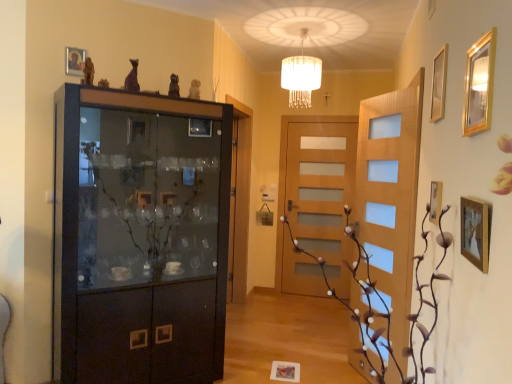
The height and width of the screenshot is (384, 512). What do you see at coordinates (75, 61) in the screenshot?
I see `wooden picture frame at upper left, which appears as the fifth picture frame when viewed from the right` at bounding box center [75, 61].

How much space does wooden picture frame at upper left, arranged as the 5th picture frame when ordered from the bottom, occupy horizontally?

The width of wooden picture frame at upper left, arranged as the 5th picture frame when ordered from the bottom, is 0.90 inches.

In order to face gold-framed mirror at upper right, which ranks as the 3th picture frame in bottom-to-top order, should I rotate leftwards or rightwards?

To align with it, rotate right about 27.551°.

Where is `gold metallic picture frame at upper right, the third picture frame from the front`? The width and height of the screenshot is (512, 384). gold metallic picture frame at upper right, the third picture frame from the front is located at coordinates (439, 84).

What is the approximate height of brown textured plant at center?

It is 1.06 meters.

The height and width of the screenshot is (384, 512). In order to click on wooden picture frame at upper left, arranged as the 5th picture frame when ordered from the bottom in this screenshot , I will do `click(75, 61)`.

Is wooden picture frame at upper left, which appears as the fifth picture frame when viewed from the right, looking in the opposite direction of white fabric lampshade at upper center?

No, white fabric lampshade at upper center is not at the back of wooden picture frame at upper left, which appears as the fifth picture frame when viewed from the right.

Are wooden picture frame at upper left, which is counted as the 4th picture frame, starting from the front, and white fabric lampshade at upper center located far from each other?

That's right, there is a large distance between wooden picture frame at upper left, which is counted as the 4th picture frame, starting from the front, and white fabric lampshade at upper center.

Does wooden picture frame at upper left, which appears as the fifth picture frame when viewed from the right, have a lesser width compared to white fabric lampshade at upper center?

Yes.

Can white fabric lampshade at upper center be found inside wooden picture frame at upper left, acting as the first picture frame starting from the left?

No, white fabric lampshade at upper center is not inside wooden picture frame at upper left, acting as the first picture frame starting from the left.

Which point is more forward, (213, 134) or (67, 64)?

Positioned in front is point (67, 64).

Considering the sizes of objects matte black cabinet at left and wooden picture frame at upper left, which is counted as the 4th picture frame, starting from the front, in the image provided, who is taller, matte black cabinet at left or wooden picture frame at upper left, which is counted as the 4th picture frame, starting from the front,?

With more height is matte black cabinet at left.

Find the location of a particular element. The height and width of the screenshot is (384, 512). cupboard on the right of wooden picture frame at upper left, arranged as the 5th picture frame when ordered from the bottom is located at coordinates (140, 237).

Is wooden picture frame at upper left, which appears as the fifth picture frame when viewed from the right, bigger or smaller than gold-framed mirror at upper right, which appears as the third picture frame when viewed from the top?

wooden picture frame at upper left, which appears as the fifth picture frame when viewed from the right, is smaller than gold-framed mirror at upper right, which appears as the third picture frame when viewed from the top.

Is there a large distance between wooden picture frame at upper left, which appears as the fifth picture frame when viewed from the right, and gold-framed mirror at upper right, positioned as the 2th picture frame in right-to-left order?

wooden picture frame at upper left, which appears as the fifth picture frame when viewed from the right, is positioned a significant distance from gold-framed mirror at upper right, positioned as the 2th picture frame in right-to-left order.

How much distance is there between wooden picture frame at upper left, positioned as the second picture frame in back-to-front order, and gold-framed mirror at upper right, which ranks as the 3th picture frame in bottom-to-top order?

wooden picture frame at upper left, positioned as the second picture frame in back-to-front order, is 7.08 feet from gold-framed mirror at upper right, which ranks as the 3th picture frame in bottom-to-top order.

From the image's perspective, is wooden picture frame at upper left, which is counted as the 4th picture frame, starting from the front, located above or below gold-framed mirror at upper right, which appears as the third picture frame when viewed from the top?

wooden picture frame at upper left, which is counted as the 4th picture frame, starting from the front, is above gold-framed mirror at upper right, which appears as the third picture frame when viewed from the top.

Locate an element on the screen. The height and width of the screenshot is (384, 512). the 2nd picture frame in front of the wooden picture frame at lower center, the second picture frame when ordered from left to right is located at coordinates (439, 84).

Consider the image. Between gold metallic picture frame at upper right, positioned as the 2th picture frame in top-to-bottom order, and wooden picture frame at lower center, acting as the fourth picture frame starting from the right, which one has smaller size?

wooden picture frame at lower center, acting as the fourth picture frame starting from the right, is smaller.

Which is in front, point (434, 67) or point (298, 382)?

The point (434, 67) is more forward.

Is gold-framed mirror at upper right, which appears as the fourth picture frame when viewed from the back, smaller than wooden picture frame at upper left, which appears as the fifth picture frame when viewed from the right?

Actually, gold-framed mirror at upper right, which appears as the fourth picture frame when viewed from the back, might be larger than wooden picture frame at upper left, which appears as the fifth picture frame when viewed from the right.

Is gold-framed mirror at upper right, which ranks as the 3th picture frame in bottom-to-top order, inside or outside of wooden picture frame at upper left, which appears as the fifth picture frame when viewed from the right?

gold-framed mirror at upper right, which ranks as the 3th picture frame in bottom-to-top order, is not enclosed by wooden picture frame at upper left, which appears as the fifth picture frame when viewed from the right.

Considering the points (475, 62) and (78, 56), which point is in front, point (475, 62) or point (78, 56)?

The point (475, 62) is closer.

Identify the location of the 3rd picture frame counting from the left of the gold-framed mirror at upper right, which appears as the fourth picture frame when viewed from the back. Image resolution: width=512 pixels, height=384 pixels. (75, 61).

In the image, is white fabric lampshade at upper center on the left side or the right side of matte purple statue at upper center, the 2th art from the right?

From the image, it's evident that white fabric lampshade at upper center is to the right of matte purple statue at upper center, the 2th art from the right.

Considering the sizes of white fabric lampshade at upper center and matte purple statue at upper center, placed as the 1th art when sorted from left to right, in the image, is white fabric lampshade at upper center taller or shorter than matte purple statue at upper center, placed as the 1th art when sorted from left to right,?

white fabric lampshade at upper center is taller than matte purple statue at upper center, placed as the 1th art when sorted from left to right.

Which point is more distant from viewer, (306,86) or (127,75)?

The point (306,86) is behind.

Which object is thinner, wooden picture frame at lower center, marked as the 5th picture frame in a front-to-back arrangement, or wooden picture frame at right, the 1th picture frame when ordered from front to back?

With smaller width is wooden picture frame at right, the 1th picture frame when ordered from front to back.

Can wooden picture frame at right, which is counted as the 3th picture frame, starting from the left, be found inside wooden picture frame at lower center, marked as the 5th picture frame in a front-to-back arrangement?

No, wooden picture frame at right, which is counted as the 3th picture frame, starting from the left, is not surrounded by wooden picture frame at lower center, marked as the 5th picture frame in a front-to-back arrangement.

Who is taller, wooden picture frame at lower center, the second picture frame when ordered from left to right, or wooden picture frame at right, the 4th picture frame from the top?

wooden picture frame at right, the 4th picture frame from the top, is taller.

Is wooden picture frame at lower center, acting as the fourth picture frame starting from the right, positioned in front of wooden picture frame at right, arranged as the second picture frame when ordered from the bottom?

No, it is not.

The width and height of the screenshot is (512, 384). Identify the location of the 1st picture frame below the white fabric lampshade at upper center (from the image's perspective). (75, 61).

There is a matte black cabinet at left. At what (x,y) coordinates should I click in order to perform the action: click on the 4th picture frame above it (from the image's perspective). Please return your answer as a coordinate pair (x, y). This screenshot has height=384, width=512. Looking at the image, I should click on (75, 61).

Looking at the image, which one is located further to gold-framed mirror at upper right, the 2th picture frame positioned from the front, matte black cabinet at left or wooden picture frame at upper left, which is counted as the 4th picture frame, starting from the front?

wooden picture frame at upper left, which is counted as the 4th picture frame, starting from the front, is positioned further to the anchor gold-framed mirror at upper right, the 2th picture frame positioned from the front.

Considering their positions, is satin gold statue at upper center, which is the 2th art in left-to-right order, positioned closer to brown textured plant at center than matte black cabinet at left?

matte black cabinet at left lies closer to brown textured plant at center than the other object.

Looking at the image, which one is located closer to wooden picture frame at upper left, placed as the first picture frame when sorted from top to bottom, matte purple statue at upper center, the first art positioned from the front, or gold-framed mirror at upper right, which appears as the fourth picture frame when viewed from the back?

matte purple statue at upper center, the first art positioned from the front, is closer to wooden picture frame at upper left, placed as the first picture frame when sorted from top to bottom.

From the picture: Based on their spatial positions, is matte black cabinet at left or wooden picture frame at right, positioned as the third picture frame in right-to-left order, further from satin gold statue at upper center, which is the 1th art in right-to-left order?

Based on the image, wooden picture frame at right, positioned as the third picture frame in right-to-left order, appears to be further to satin gold statue at upper center, which is the 1th art in right-to-left order.

Looking at the image, which one is located closer to wooden picture frame at right, positioned as the third picture frame in right-to-left order, satin gold statue at upper center, which is the 2th art in left-to-right order, or gold metallic picture frame at upper right, marked as the first picture frame in a right-to-left arrangement?

Among the two, gold metallic picture frame at upper right, marked as the first picture frame in a right-to-left arrangement, is located nearer to wooden picture frame at right, positioned as the third picture frame in right-to-left order.

Estimate the real-world distances between objects in this image. Which object is closer to wooden picture frame at right, which is the 5th picture frame in back-to-front order, gold metallic picture frame at upper right, acting as the fifth picture frame starting from the left, or white fabric lampshade at upper center?

The object closer to wooden picture frame at right, which is the 5th picture frame in back-to-front order, is gold metallic picture frame at upper right, acting as the fifth picture frame starting from the left.

Looking at the image, which one is located closer to matte purple statue at upper center, which ranks as the 2th art in back-to-front order, satin gold statue at upper center, which is the 1th art in right-to-left order, or brown textured plant at center?

satin gold statue at upper center, which is the 1th art in right-to-left order.

Which object lies further to the anchor point satin gold statue at upper center, the second art when ordered from front to back, white fabric lampshade at upper center or gold-framed mirror at upper right, which ranks as the 3th picture frame in bottom-to-top order?

The object further to satin gold statue at upper center, the second art when ordered from front to back, is gold-framed mirror at upper right, which ranks as the 3th picture frame in bottom-to-top order.

Where is `plant between wooden picture frame at upper left, arranged as the 5th picture frame when ordered from the bottom, and gold-framed mirror at upper right, which appears as the third picture frame when viewed from the top`? plant between wooden picture frame at upper left, arranged as the 5th picture frame when ordered from the bottom, and gold-framed mirror at upper right, which appears as the third picture frame when viewed from the top is located at coordinates [x=386, y=303].

The image size is (512, 384). I want to click on cupboard between brown textured plant at center and satin gold statue at upper center, the 1th art in the back-to-front sequence, along the z-axis, so click(140, 237).

Locate an element on the screen. This screenshot has width=512, height=384. plant between matte purple statue at upper center, the 2th art from the right, and gold metallic picture frame at upper right, the 3th picture frame viewed from the back, from left to right is located at coordinates (386, 303).

Locate an element on the screen. cupboard between matte purple statue at upper center, which ranks as the 2th art in back-to-front order, and gold metallic picture frame at upper right, the third picture frame from the front is located at coordinates (140, 237).